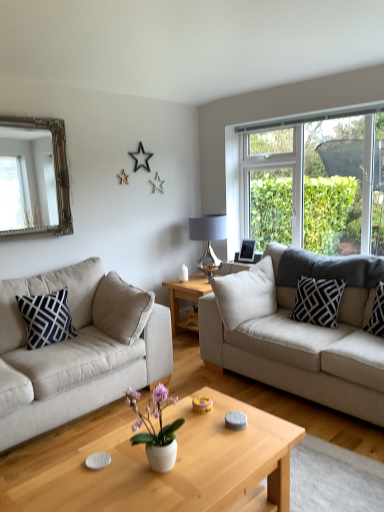
Question: Is beige fabric couch at right, which is the second studio couch in left-to-right order, to the right of silver metallic picture frame at upper right from the viewer's perspective?

Choices:
 (A) yes
 (B) no

Answer: (A)

Question: From the image's perspective, is beige fabric couch at right, which is the second studio couch in left-to-right order, over silver metallic picture frame at upper right?

Choices:
 (A) yes
 (B) no

Answer: (B)

Question: From the image's perspective, is beige fabric couch at right, which is the second studio couch in left-to-right order, located beneath silver metallic picture frame at upper right?

Choices:
 (A) no
 (B) yes

Answer: (B)

Question: Considering the relative positions of beige fabric couch at right, which is the first studio couch from right to left, and silver metallic picture frame at upper right in the image provided, is beige fabric couch at right, which is the first studio couch from right to left, to the left of silver metallic picture frame at upper right from the viewer's perspective?

Choices:
 (A) yes
 (B) no

Answer: (B)

Question: Is beige fabric couch at right, which is the first studio couch from right to left, behind silver metallic picture frame at upper right?

Choices:
 (A) yes
 (B) no

Answer: (B)

Question: Is the depth of beige fabric couch at right, which is the second studio couch in left-to-right order, less than that of silver metallic picture frame at upper right?

Choices:
 (A) no
 (B) yes

Answer: (B)

Question: Is beige fabric couch at right, which is the first studio couch from right to left, to the right of navy blue/white geometric pillow at left, which is the third pillow in right-to-left order, from the viewer's perspective?

Choices:
 (A) no
 (B) yes

Answer: (B)

Question: Is beige fabric couch at right, which is the second studio couch in left-to-right order, surrounding navy blue/white geometric pillow at left, the first pillow when ordered from left to right?

Choices:
 (A) yes
 (B) no

Answer: (B)

Question: From the image's perspective, is beige fabric couch at right, which is the first studio couch from right to left, below navy blue/white geometric pillow at left, which is the third pillow in right-to-left order?

Choices:
 (A) yes
 (B) no

Answer: (A)

Question: Is beige fabric couch at right, which is the second studio couch in left-to-right order, shorter than navy blue/white geometric pillow at left, the first pillow when ordered from left to right?

Choices:
 (A) no
 (B) yes

Answer: (A)

Question: Is beige fabric couch at right, which is the first studio couch from right to left, outside navy blue/white geometric pillow at left, the first pillow when ordered from left to right?

Choices:
 (A) no
 (B) yes

Answer: (B)

Question: Can you confirm if beige fabric couch at right, which is the first studio couch from right to left, is bigger than navy blue/white geometric pillow at left, which is the third pillow in right-to-left order?

Choices:
 (A) yes
 (B) no

Answer: (A)

Question: From a real-world perspective, is wooden coffee table at center, arranged as the first coffee table when viewed from the top, physically above black and white patterned pillow at right, the 2th pillow viewed from the right?

Choices:
 (A) yes
 (B) no

Answer: (B)